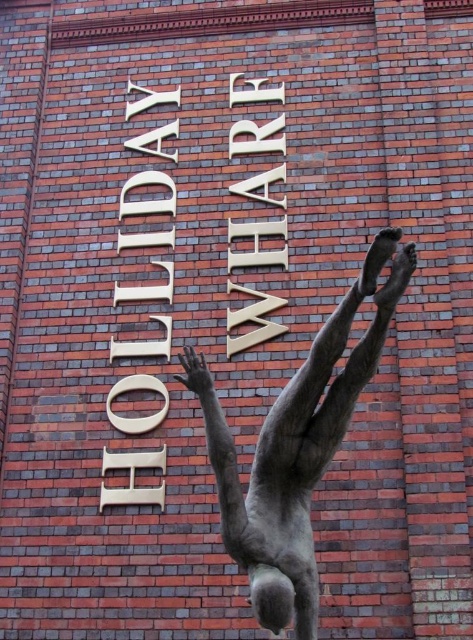
Based on the photo, you are standing in front of the brick wall with the text HOLIDAY WHARF. You see a polished bronze diver at center and a gold metallic sign at center. Which object is positioned to the right of the other?

The polished bronze diver at center is to the right of the gold metallic sign at center.

From the picture: You are standing in front of the brick wall with the text HOLIDAY WHARF. You see two points marked on the wall at coordinates point (324, 464) and point (147, 292). Which of these points is closer to you?

Point (324, 464) is in front of point (147, 292), so it is closer to you.